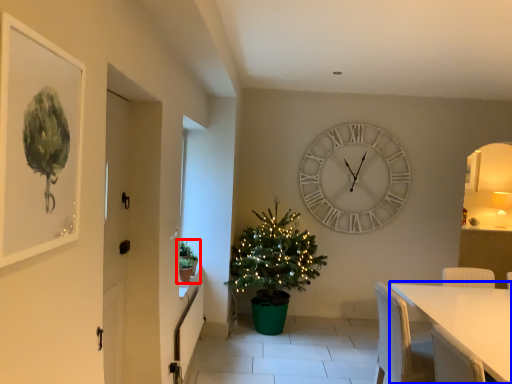
Question: Which object is closer to the camera taking this photo, houseplant (highlighted by a red box) or table (highlighted by a blue box)?

Choices:
 (A) houseplant
 (B) table

Answer: (B)